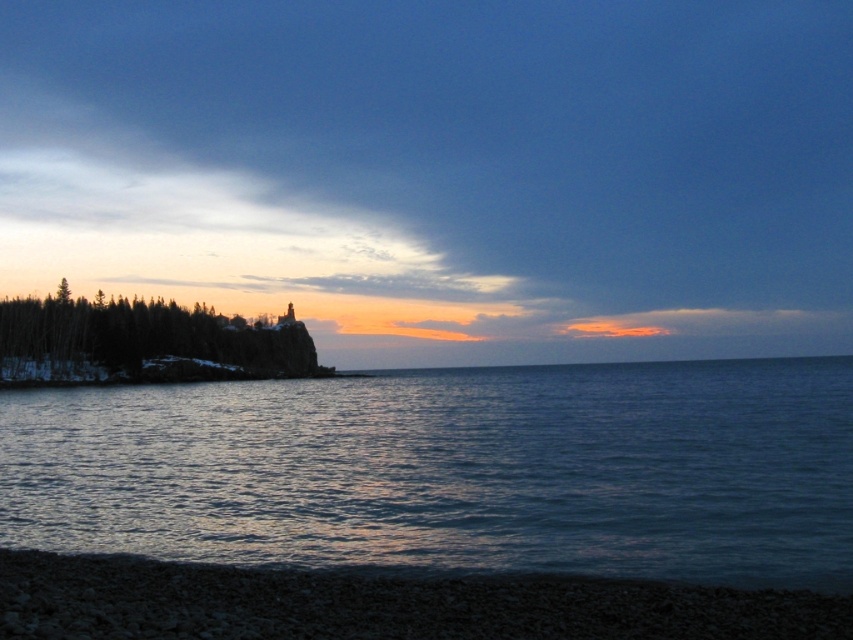
You are standing on the rocky shoreline and want to walk towards the blue water at center. Are the green matte trees at left blocking your path?

The blue water at center has a larger size compared to green matte trees at left, so the green matte trees at left are not blocking your path to the blue water at center.

You are standing at the center of the image and want to walk towards the blue water at center. According to the coordinates given, in which direction should you move?

The blue water at center is located at coordinates point (451,470). Since you are at the center of the image, you should move towards the right direction to reach the blue water at center.